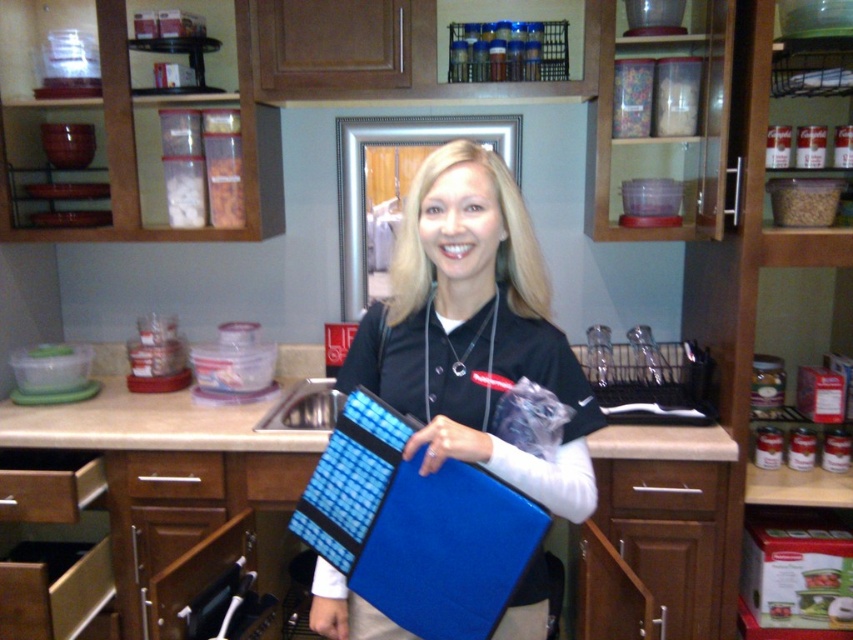
Does blue fabric folder at center appear on the right side of brown wood drawer at lower left?

Yes, blue fabric folder at center is to the right of brown wood drawer at lower left.

Between point (495, 230) and point (204, 477), which one is positioned in front?

Point (495, 230) is more forward.

Where is `blue fabric folder at center`? blue fabric folder at center is located at coordinates (473, 330).

Who is lower down, blue fabric folder at center or brown wood drawer at center?

brown wood drawer at center is below.

Which is behind, point (361, 321) or point (700, 476)?

The point (700, 476) is behind.

Who is more distant from viewer, (438,355) or (675,461)?

Point (675,461)

Where is `blue fabric folder at center`? This screenshot has height=640, width=853. blue fabric folder at center is located at coordinates (473, 330).

Can you confirm if wooden drawer at lower left is taller than brown wood drawer at center?

Yes, wooden drawer at lower left is taller than brown wood drawer at center.

Is wooden drawer at lower left further to camera compared to brown wood drawer at center?

No, it is not.

Is point (22, 516) closer to camera compared to point (636, 496)?

Yes, it is.

This screenshot has width=853, height=640. I want to click on wooden drawer at lower left, so 47,484.